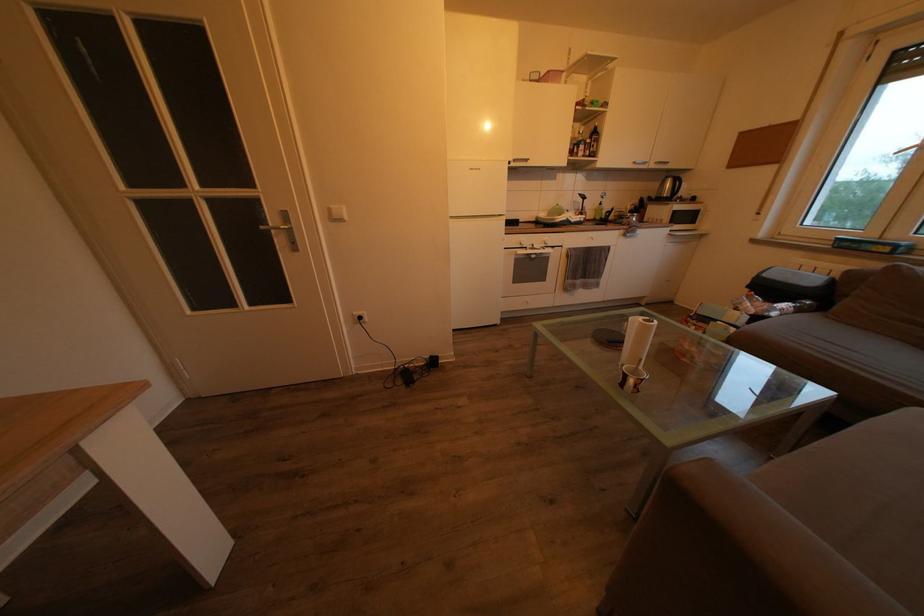
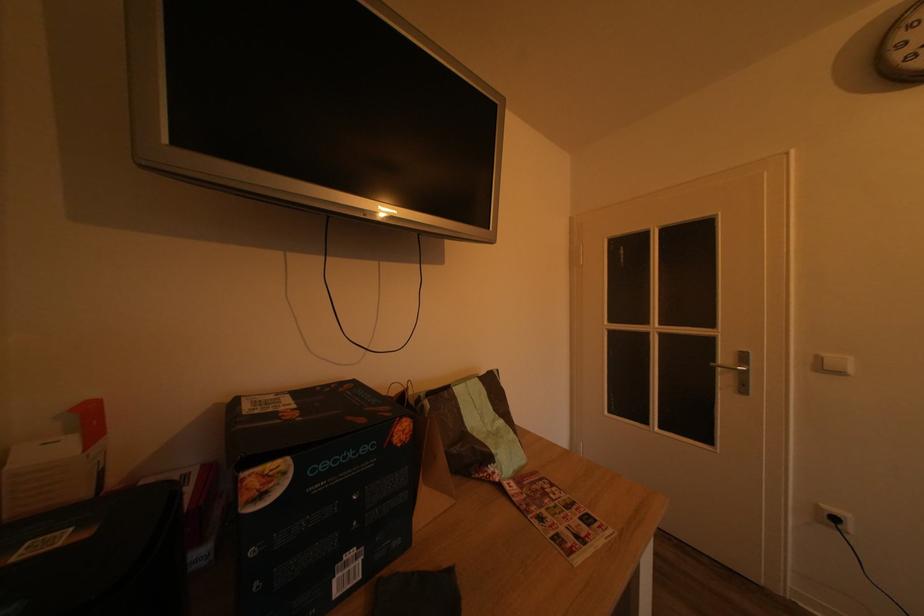
Where in the second image is the point corresponding to point 337,217 from the first image?

(825, 365)